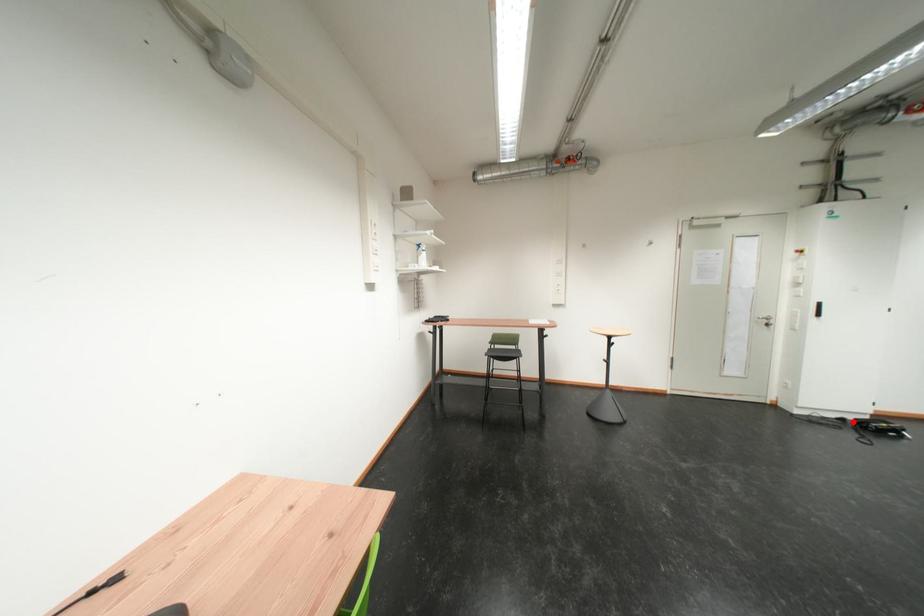
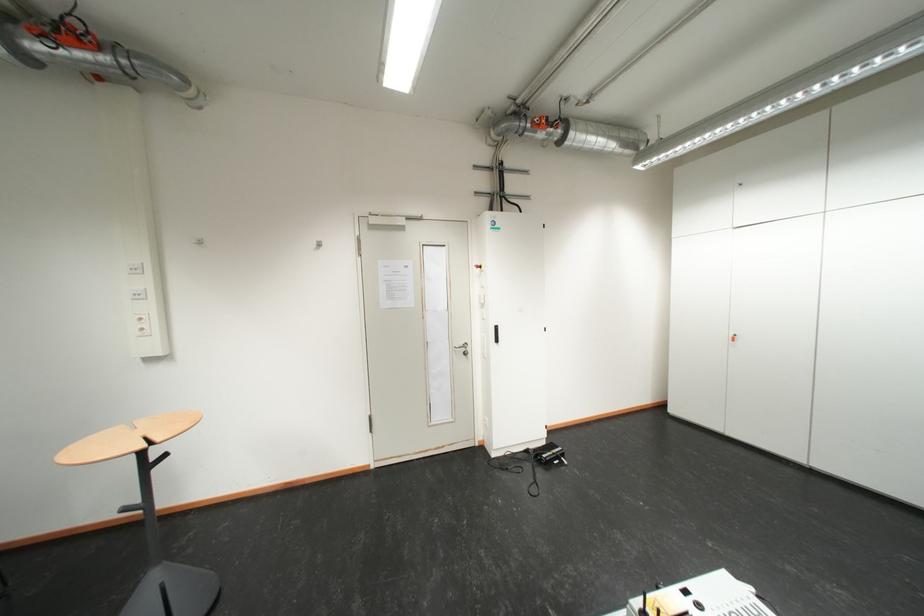
Question: I am providing you with two images of the same scene from different viewpoints. In image1, a red point is highlighted. Considering the same 3D point in image2, which of the following is correct?

Choices:
 (A) It is closer
 (B) It is farther

Answer: (A)